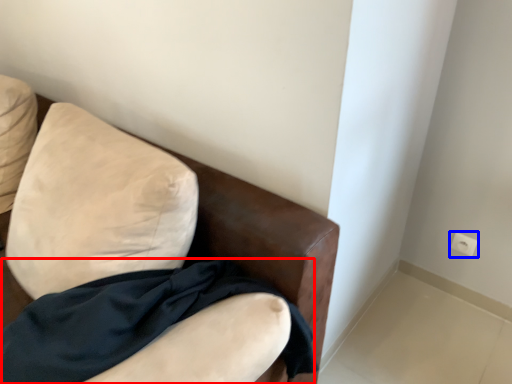
Question: Which object appears farthest to the camera in this image, fabric (highlighted by a red box) or electric outlet (highlighted by a blue box)?

Choices:
 (A) fabric
 (B) electric outlet

Answer: (B)